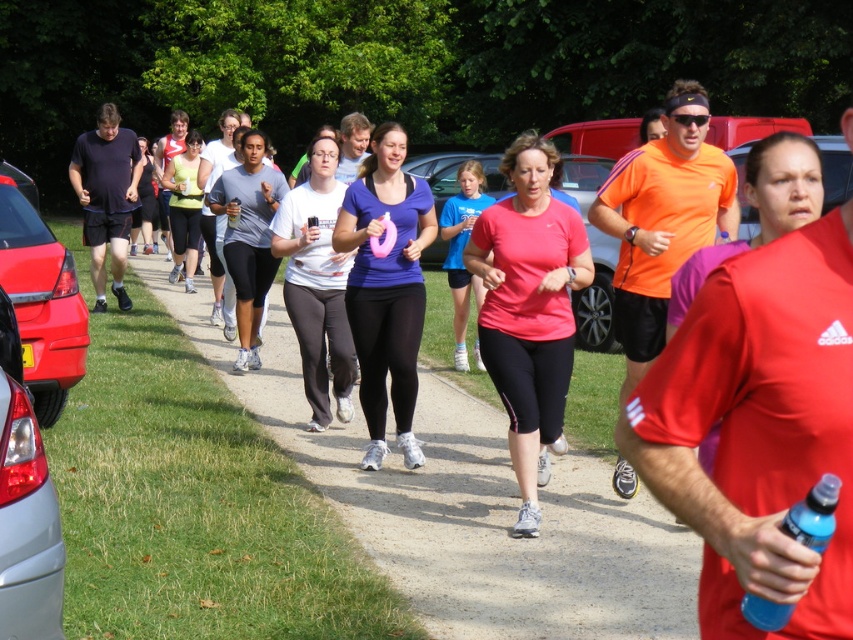
Can you confirm if orange fabric shirt at center is smaller than blue plastic bottle at lower right?

No, orange fabric shirt at center is not smaller than blue plastic bottle at lower right.

Does orange fabric shirt at center appear under blue plastic bottle at lower right?

Actually, orange fabric shirt at center is above blue plastic bottle at lower right.

Describe the element at coordinates (662, 220) in the screenshot. I see `orange fabric shirt at center` at that location.

Where is `orange fabric shirt at center`? orange fabric shirt at center is located at coordinates (662, 220).

Does dirt path at center have a lesser width compared to silver metallic car at lower left?

Incorrect, dirt path at center's width is not less than silver metallic car at lower left's.

Can you confirm if dirt path at center is positioned below silver metallic car at lower left?

Correct, dirt path at center is located below silver metallic car at lower left.

Is point (346, 499) positioned in front of point (39, 602)?

No, (346, 499) is behind (39, 602).

This screenshot has width=853, height=640. I want to click on dirt path at center, so click(467, 506).

Does matte purple shirt at center lie behind matte black shorts at left?

No, it is in front of matte black shorts at left.

Which is more to the left, matte purple shirt at center or matte black shorts at left?

matte black shorts at left

Between point (363, 179) and point (102, 120), which one is positioned behind?

Positioned behind is point (102, 120).

Locate an element on the screen. This screenshot has height=640, width=853. matte purple shirt at center is located at coordinates (386, 288).